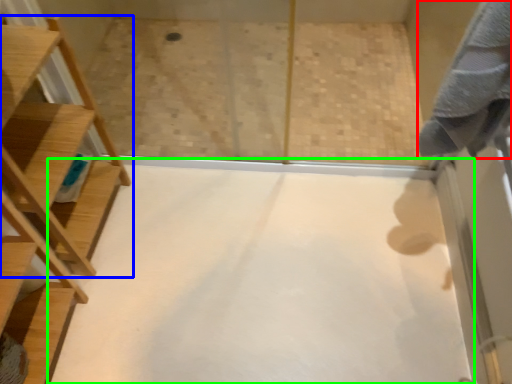
Question: Which object is positioned farthest from bath towel (highlighted by a red box)? Select from furniture (highlighted by a blue box) and plain (highlighted by a green box).

Choices:
 (A) furniture
 (B) plain

Answer: (A)